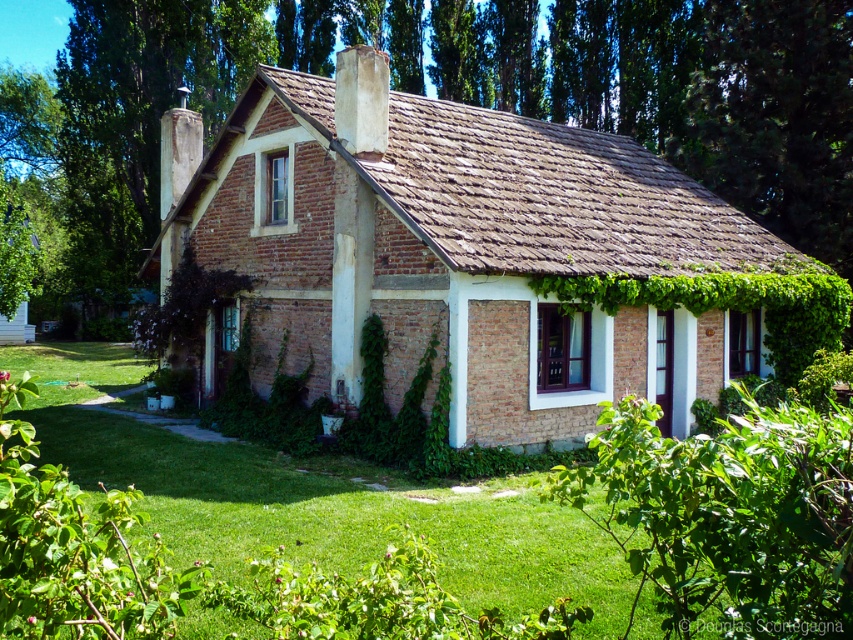
Which of these two, brown brick cottage at center or green leafy hedge at lower right, stands shorter?

Standing shorter between the two is green leafy hedge at lower right.

Does brown brick cottage at center appear on the right side of green leafy hedge at lower right?

In fact, brown brick cottage at center is to the left of green leafy hedge at lower right.

At what (x,y) coordinates should I click in order to perform the action: click on brown brick cottage at center. Please return your answer as a coordinate pair (x, y). The width and height of the screenshot is (853, 640). Looking at the image, I should click on (477, 257).

Identify the location of brown brick cottage at center. (477, 257).

I want to click on green grass at center, so click(x=202, y=573).

What are the coordinates of `green grass at center` in the screenshot? It's located at (202, 573).

Is brown brick cottage at center below green grass at center?

No.

Which is in front, point (376, 68) or point (258, 600)?

Positioned in front is point (258, 600).

I want to click on brown brick cottage at center, so click(477, 257).